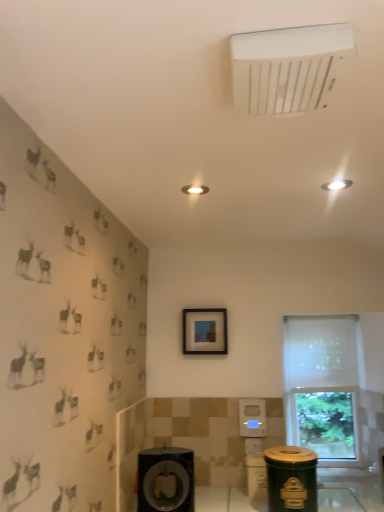
Question: In terms of width, does matte black picture frame at center look wider or thinner when compared to white plastic air conditioning unit at upper center?

Choices:
 (A) thin
 (B) wide

Answer: (A)

Question: Considering the positions of matte black picture frame at center and white plastic air conditioning unit at upper center in the image, is matte black picture frame at center taller or shorter than white plastic air conditioning unit at upper center?

Choices:
 (A) short
 (B) tall

Answer: (B)

Question: Which is nearer to the green matte trash can at lower right?

Choices:
 (A) white sheer curtain at right
 (B) white plastic air conditioning unit at upper center
 (C) matte black picture frame at center
 (D) matte black speaker at lower center
 (E) white frosted glass window at right

Answer: (D)

Question: Based on their relative distances, which object is farther from the matte black speaker at lower center?

Choices:
 (A) white plastic air conditioning unit at upper center
 (B) matte black picture frame at center
 (C) white sheer curtain at right
 (D) white frosted glass window at right
 (E) green matte trash can at lower right

Answer: (A)